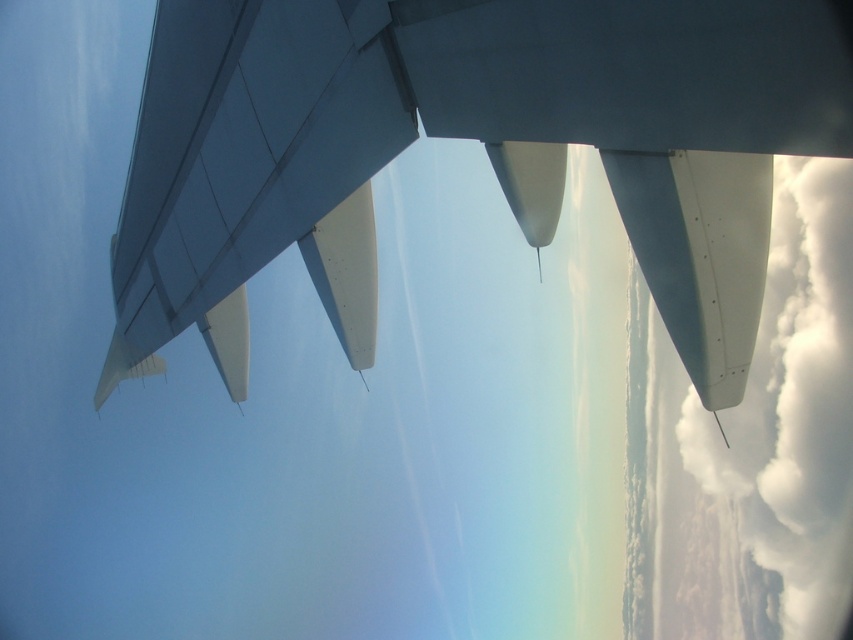
You are a passenger sitting in an aircraft seat and looking out the window. You notice a point marked at coordinates (465, 138). Based on the scene, what object is this point most likely located on?

The point at (465, 138) is on the matte white wing at upper center.

You are a pilot checking the aircraft wing structure through the window. You notice two points marked on the wing. The first point is at coordinates point (171, 193) and the second is at point (820, 314). From your vantage point inside the cockpit, which point is closer to you?

Point (171, 193) is in front of point (820, 314), so it is closer to you.